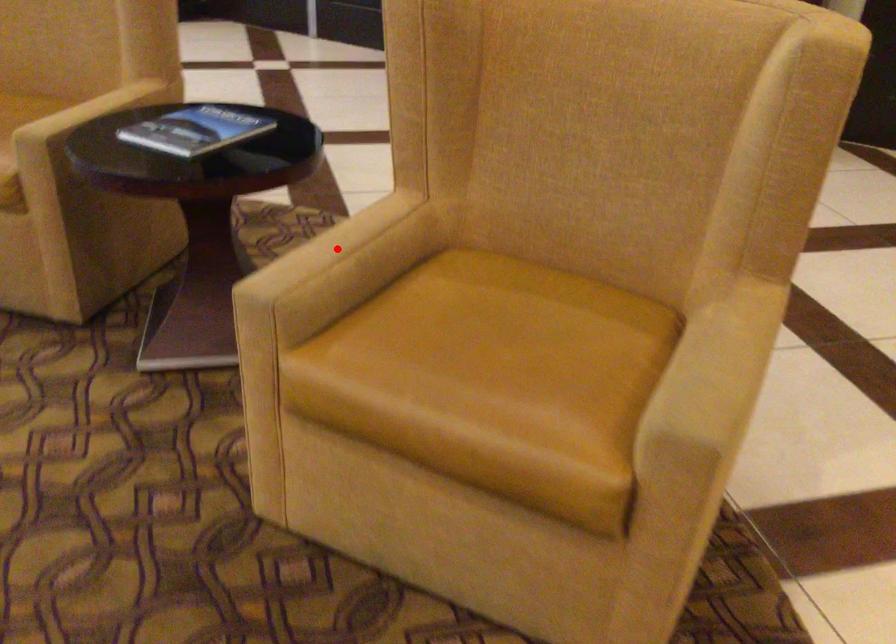
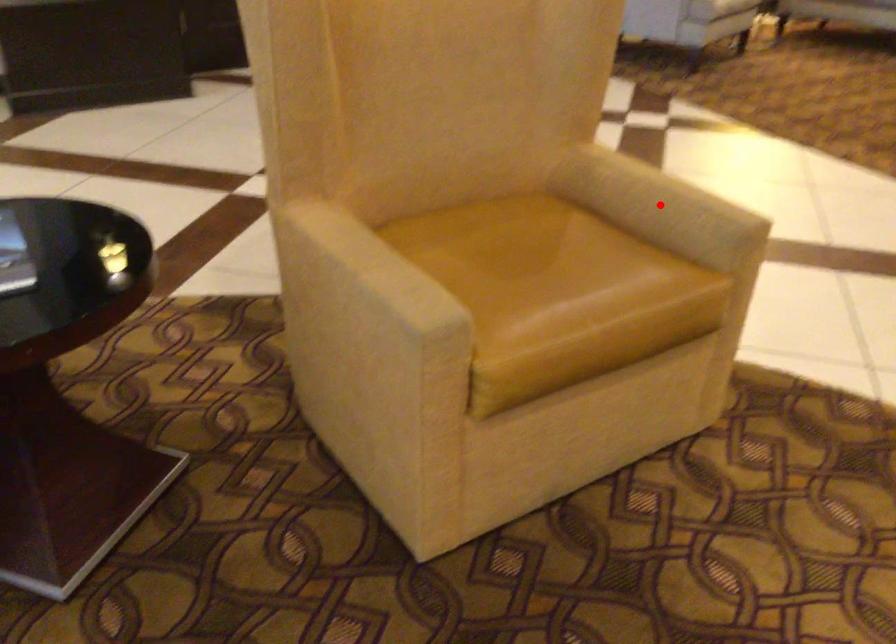
I am providing you with two images of the same scene from different viewpoints. A red point is marked on the first image and another point is marked on the second image. Does the point marked in image1 correspond to the same location as the one in image2?

No